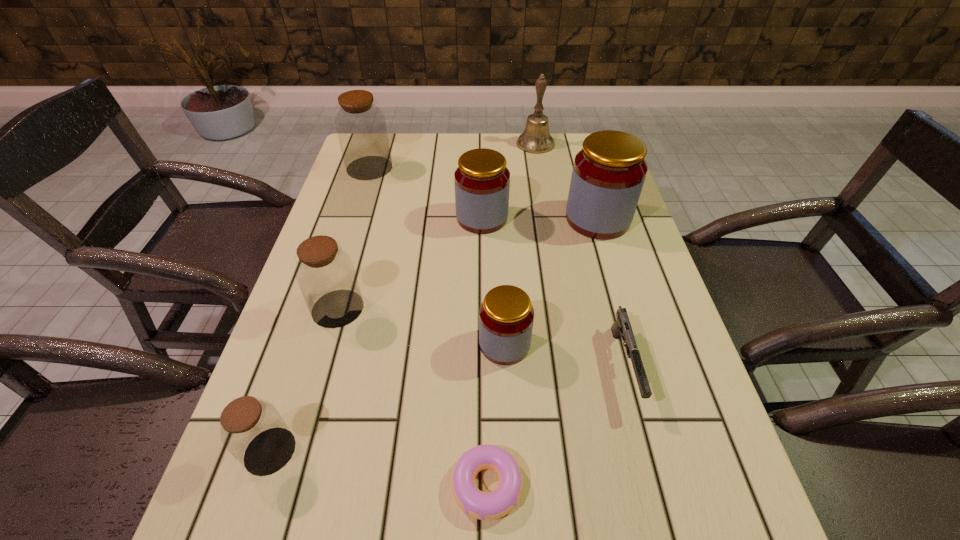
This screenshot has height=540, width=960. Identify the location of empty location between the farthest brown jar and the bell. (452, 156).

You are a GUI agent. You are given a task and a screenshot of the screen. Output one action in this format:
    pyautogui.click(x=<x>, y=<y>)
    Task: Click on the free space between the farthest jar and the gray gun
    The image size is (960, 540).
    Given the screenshot: What is the action you would take?
    pyautogui.click(x=497, y=267)

You are a GUI agent. You are given a task and a screenshot of the screen. Output one action in this format:
    pyautogui.click(x=<x>, y=<y>)
    Task: Click on the unoccupied position between the second nearest brown jar and the farthest object
    The image size is (960, 540).
    Given the screenshot: What is the action you would take?
    pyautogui.click(x=437, y=226)

In order to click on empty space that is in between the bell and the nearest red jar in this screenshot , I will do `click(520, 244)`.

Locate an element on the screen. The height and width of the screenshot is (540, 960). vacant area between the gun and the second smallest red jar is located at coordinates (553, 292).

Locate an element on the screen. free area in between the second biggest brown jar and the biggest brown jar is located at coordinates (353, 238).

You are a GUI agent. You are given a task and a screenshot of the screen. Output one action in this format:
    pyautogui.click(x=<x>, y=<y>)
    Task: Click on the vacant point located between the rightmost red jar and the doughnut
    Image resolution: width=960 pixels, height=540 pixels.
    Given the screenshot: What is the action you would take?
    pyautogui.click(x=542, y=352)

The height and width of the screenshot is (540, 960). I want to click on free point between the nearest red jar and the eighth tallest object, so click(x=564, y=355).

Locate which object ranks fourth in proximity to the rightmost jar. Please provide its 2D coordinates. Your answer should be formatted as a tuple, i.e. [(x, y)], where the tuple contains the x and y coordinates of a point satisfying the conditions above.

[(506, 316)]

Identify which object is the sixth nearest to the doughnut. Please provide its 2D coordinates. Your answer should be formatted as a tuple, i.e. [(x, y)], where the tuple contains the x and y coordinates of a point satisfying the conditions above.

[(608, 175)]